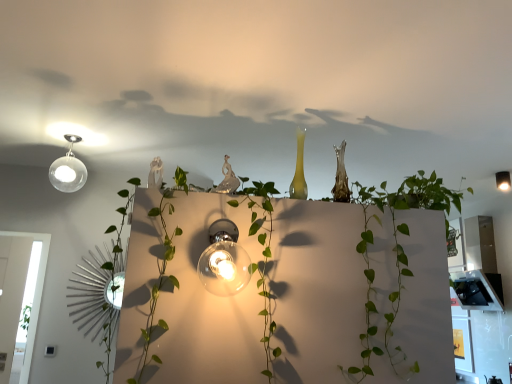
Question: From a real-world perspective, is translucent glass bulb at center, the 1th lamp positioned from the front, positioned above or below matte glass bulb at upper right, which ranks as the 1th lamp in back-to-front order?

Choices:
 (A) above
 (B) below

Answer: (B)

Question: Is translucent glass bulb at center, placed as the second lamp when sorted from right to left, in front of or behind matte glass bulb at upper right, which is counted as the 2th lamp, starting from the front, in the image?

Choices:
 (A) front
 (B) behind

Answer: (A)

Question: Does point (200, 266) appear closer or farther from the camera than point (498, 173)?

Choices:
 (A) farther
 (B) closer

Answer: (B)

Question: Considering the positions of matte glass bulb at upper right, placed as the first lamp when sorted from right to left, and translucent glass bulb at center, which appears as the 2th lamp when viewed from the top, in the image, is matte glass bulb at upper right, placed as the first lamp when sorted from right to left, taller or shorter than translucent glass bulb at center, which appears as the 2th lamp when viewed from the top,?

Choices:
 (A) tall
 (B) short

Answer: (B)

Question: Is matte glass bulb at upper right, which appears as the 2th lamp when ordered from the bottom, bigger or smaller than translucent glass bulb at center, the 1th lamp when ordered from left to right?

Choices:
 (A) small
 (B) big

Answer: (A)

Question: In terms of width, does matte glass bulb at upper right, which ranks as the 1th lamp in back-to-front order, look wider or thinner when compared to translucent glass bulb at center, the 1th lamp when ordered from left to right?

Choices:
 (A) thin
 (B) wide

Answer: (A)

Question: Relative to translucent glass bulb at center, which is the first lamp in bottom-to-top order, is matte glass bulb at upper right, which is counted as the 2th lamp, starting from the front, in front or behind?

Choices:
 (A) behind
 (B) front

Answer: (A)